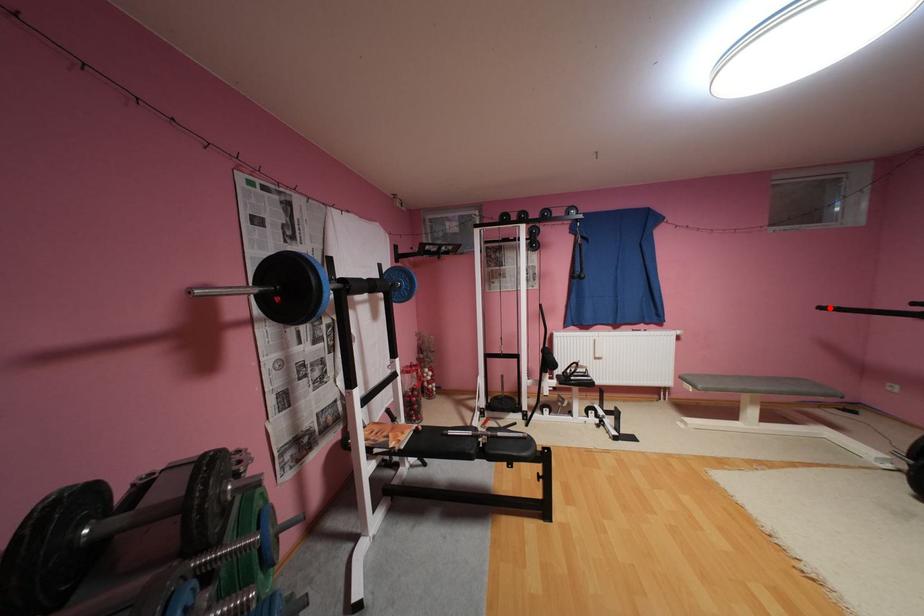
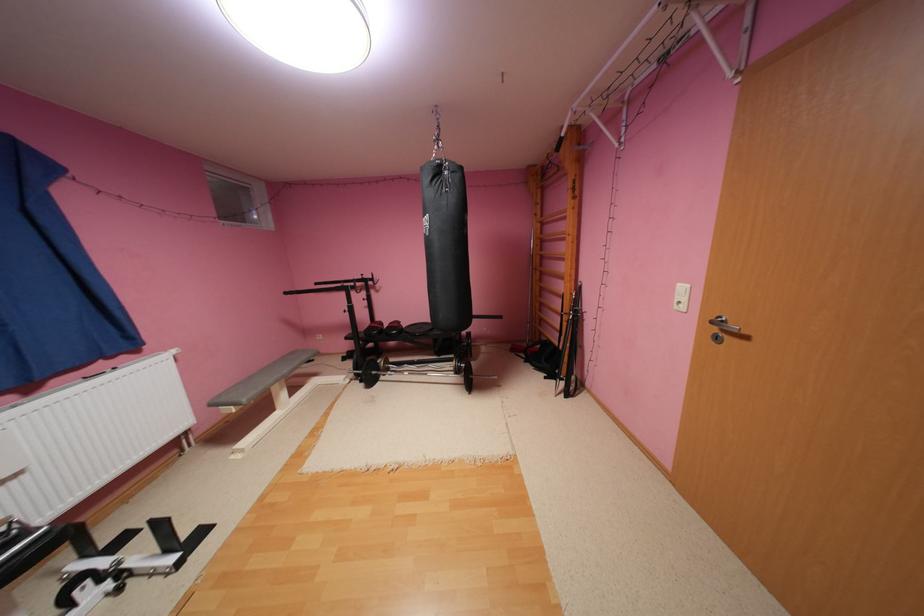
Where in the second image is the point corresponding to the highlighted location from the first image?

(295, 293)